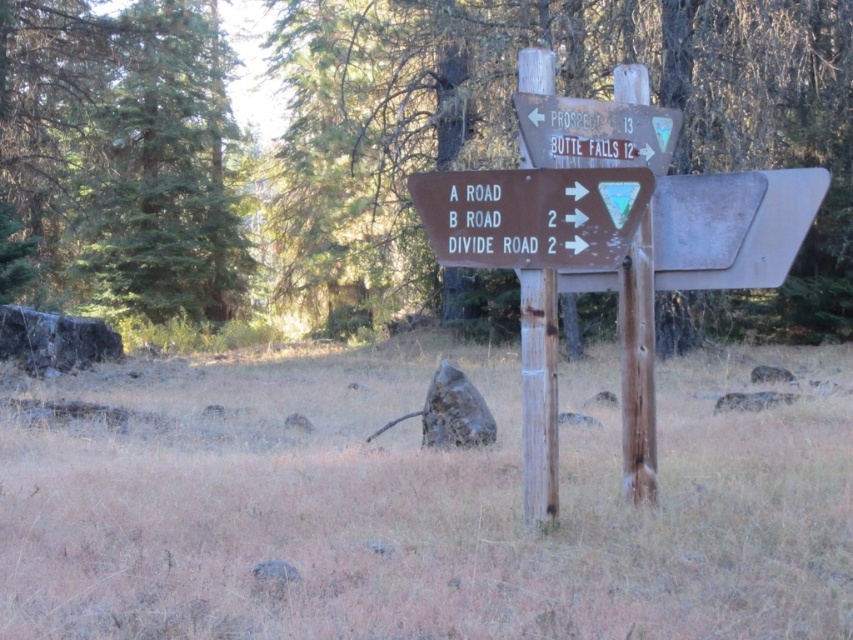
Is the position of brown wooden sign at center less distant than that of wooden sign at upper center?

Yes, it is in front of wooden sign at upper center.

Which is below, brown wooden sign at center or wooden sign at upper center?

brown wooden sign at center is below.

Does point (440, 188) come closer to viewer compared to point (567, 104)?

Yes, it is in front of point (567, 104).

Where is `brown wooden sign at center`? brown wooden sign at center is located at coordinates (532, 216).

Can you confirm if brown wood sign at center is positioned above brown wooden sign at center?

Yes.

Is brown wood sign at center wider than brown wooden sign at center?

Yes.

Where is `brown wood sign at center`? brown wood sign at center is located at coordinates (566, 93).

Can you confirm if brown wood sign at center is positioned to the left of wooden sign at upper center?

No, brown wood sign at center is not to the left of wooden sign at upper center.

Looking at this image, does brown wood sign at center have a lesser height compared to wooden sign at upper center?

No.

Describe the element at coordinates (566, 93) in the screenshot. I see `brown wood sign at center` at that location.

The image size is (853, 640). What are the coordinates of `brown wood sign at center` in the screenshot? It's located at (566, 93).